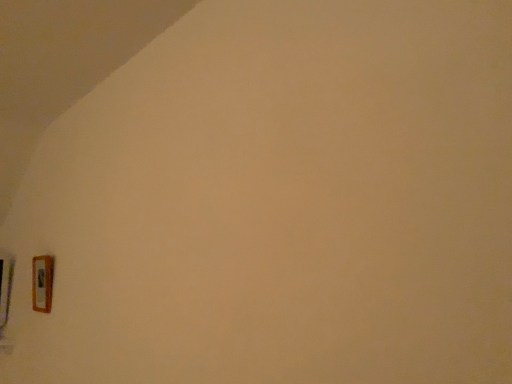
The image size is (512, 384). Describe the element at coordinates (42, 283) in the screenshot. I see `wooden door handle at lower left` at that location.

The image size is (512, 384). Identify the location of wooden door handle at lower left. [x=42, y=283].

At what (x,y) coordinates should I click in order to perform the action: click on wooden door handle at lower left. Please return your answer as a coordinate pair (x, y). Looking at the image, I should click on (42, 283).